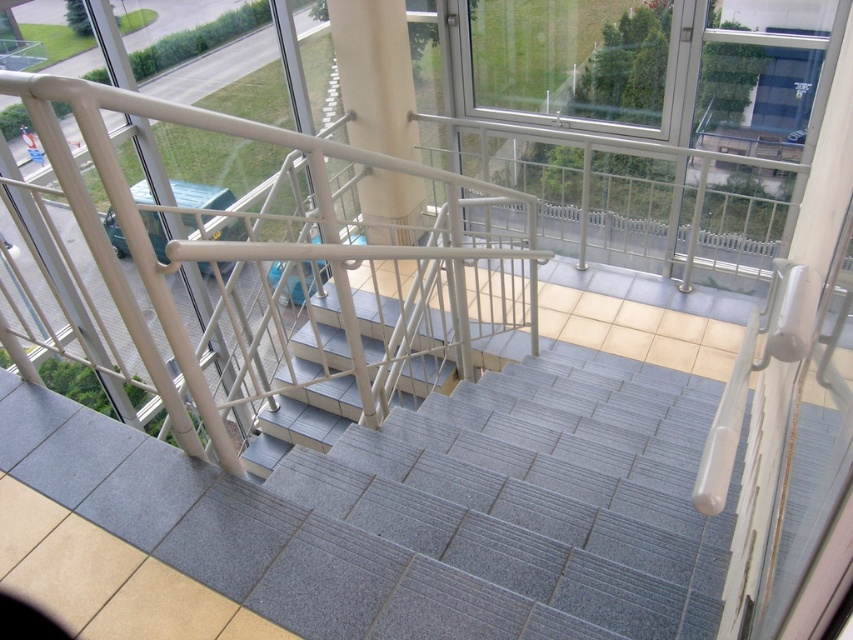
You are a delivery person carrying a large box that is 2 meters wide. You need to move it down the staircase. The transparent glass window at upper center and the white glossy pillar at center are in your path. Can you fit the box through the narrowest point between them?

The transparent glass window at upper center is wider than the white glossy pillar at center, so the narrowest point between them is the white glossy pillar at center. Since the box is 2 meters wide and the pillar is narrower than that, the box cannot fit through the narrowest point between the transparent glass window at upper center and the white glossy pillar at center.

Looking at this image, you are a delivery person carrying a large package and need to navigate the staircase. You notice the transparent glass window at upper center and the white glossy pillar at center. Which object is closer to you as you stand at the top of the staircase?

The transparent glass window at upper center is closer to you than the white glossy pillar at center.